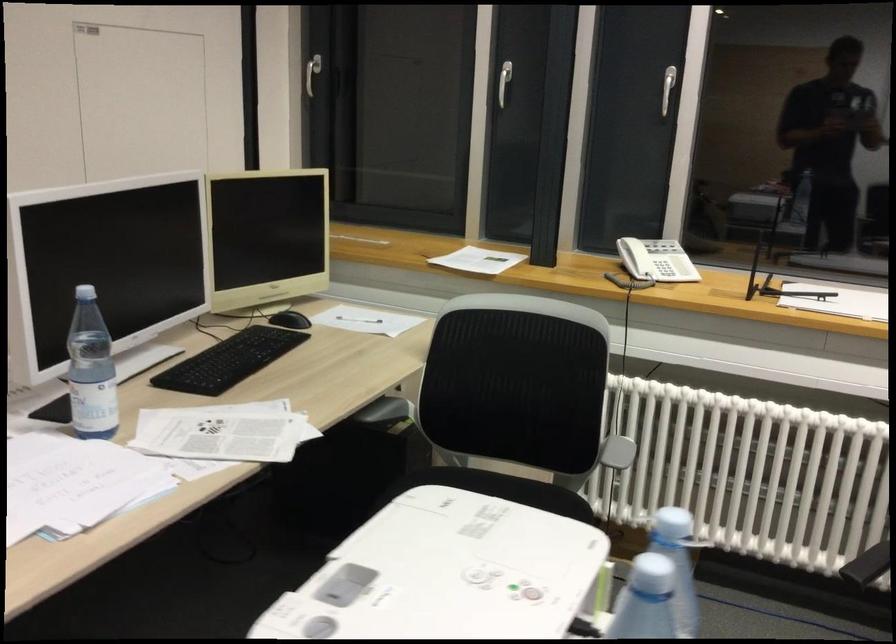
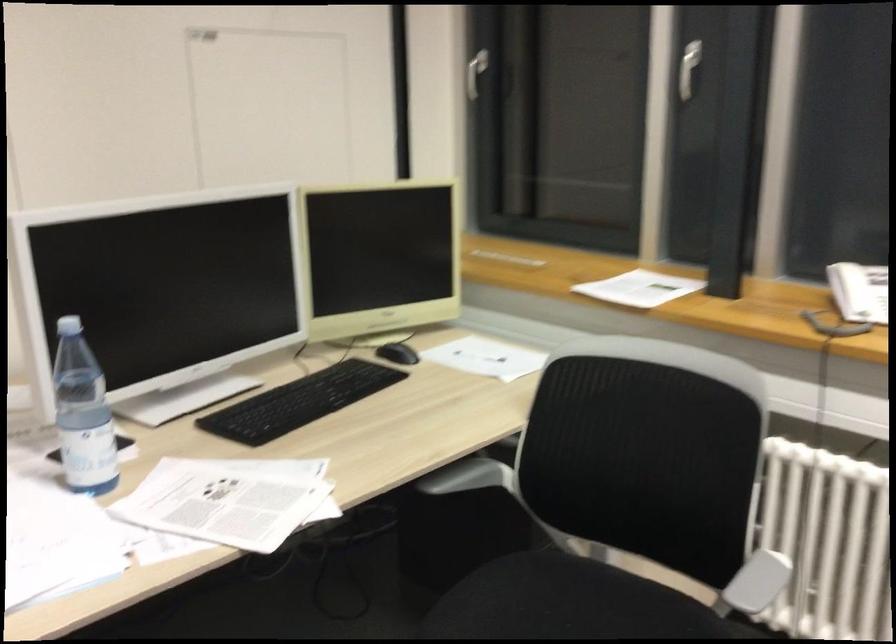
In a continuous first-person perspective shot, in which direction is the camera moving?

The movement direction of the cameraman is right, forward.